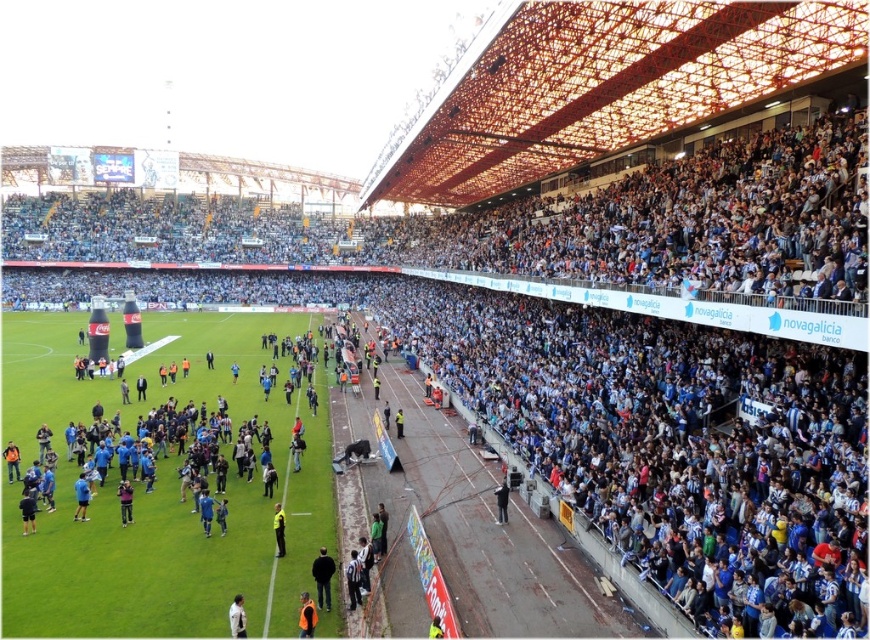
You are a photographer at the soccer stadium and want to capture a photo of the white matte shirt at lower left and the dark blue jersey at center. Which of the two items has a narrower width when viewed from your current position?

The white matte shirt at lower left is thinner than the dark blue jersey at center, so the white matte shirt at lower left has a narrower width when viewed from your current position.

You are a photographer at the soccer stadium and need to capture a clear shot of both the dark blue jersey at center and the dark blue uniform at center. Which one is closer to the camera so that you can focus on it first?

The dark blue jersey at center is positioned under the dark blue uniform at center, meaning the dark blue uniform at center is closer to the camera. Focus on the dark blue uniform at center first.